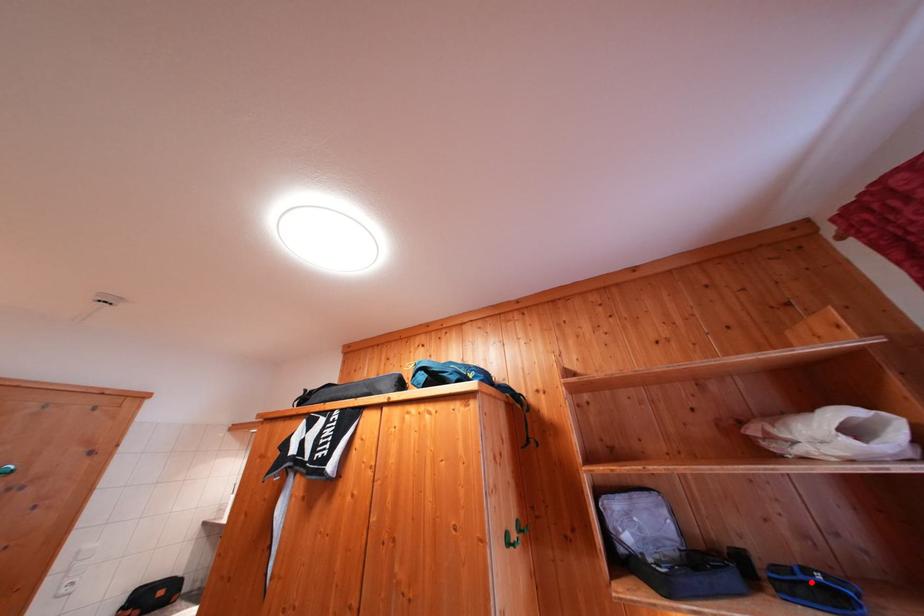
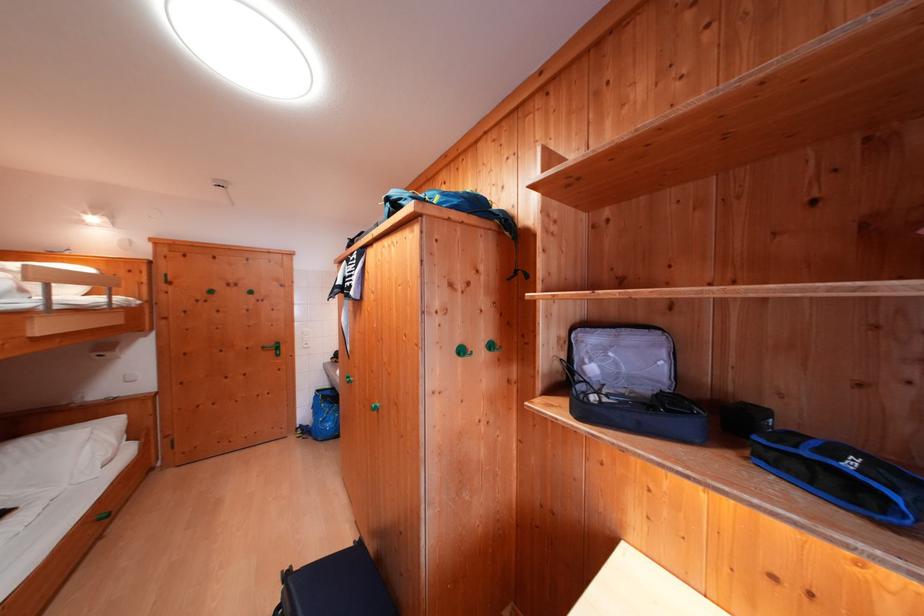
The point at the highlighted location is marked in the first image. Where is the corresponding point in the second image?

(815, 456)